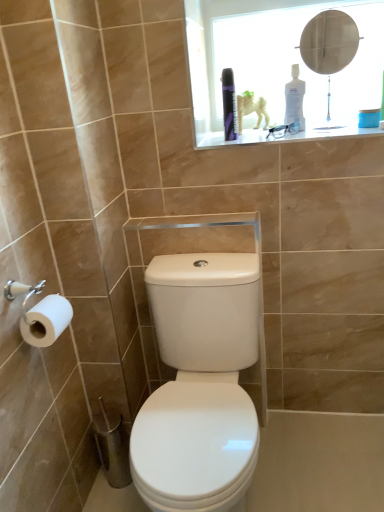
You are a GUI agent. You are given a task and a screenshot of the screen. Output one action in this format:
    pyautogui.click(x=<x>, y=<y>)
    Task: Click on the spots to the right of white plastic bottle at upper center, positioned as the first toiletry in right-to-left order
    
    Given the screenshot: What is the action you would take?
    pyautogui.click(x=336, y=125)